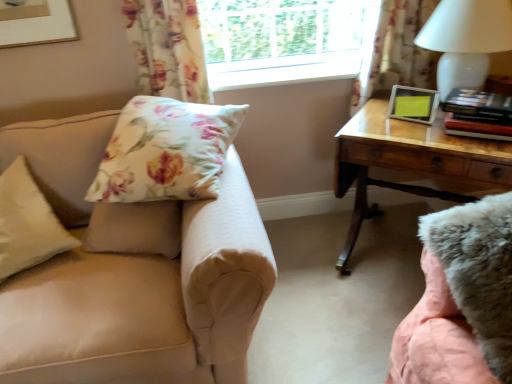
Where is `vacant area to the left of wooden desk at right`? The image size is (512, 384). vacant area to the left of wooden desk at right is located at coordinates (320, 287).